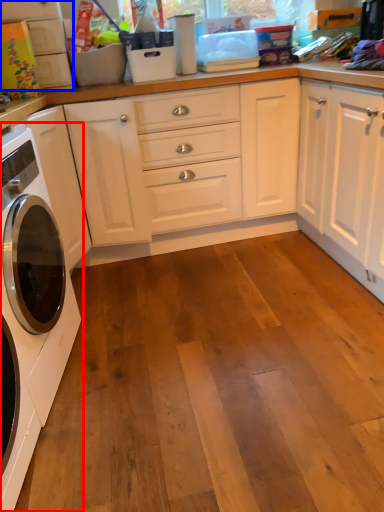
Question: Which of the following is the closest to the observer, washing machine (highlighted by a red box) or cabinetry (highlighted by a blue box)?

Choices:
 (A) washing machine
 (B) cabinetry

Answer: (A)